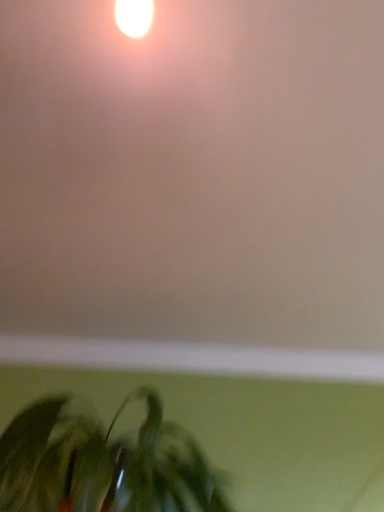
Identify the location of green matte plant at lower left. Image resolution: width=384 pixels, height=512 pixels. (103, 463).

What do you see at coordinates (103, 463) in the screenshot? I see `green matte plant at lower left` at bounding box center [103, 463].

What is the approximate height of green matte plant at lower left?

It is 11.75 inches.

In order to face matte white wall at upper center, should I rotate leftwards or rightwards?

Rotate left and turn 0.400 degrees.

I want to click on matte white wall at upper center, so click(x=194, y=172).

Measure the distance between matte white wall at upper center and camera.

matte white wall at upper center is 27.47 inches away from camera.

What do you see at coordinates (194, 172) in the screenshot?
I see `matte white wall at upper center` at bounding box center [194, 172].

Where is `green matte plant at lower left`? green matte plant at lower left is located at coordinates (103, 463).

Is green matte plant at lower left at the left side of matte white wall at upper center?

Correct, you'll find green matte plant at lower left to the left of matte white wall at upper center.

Is green matte plant at lower left positioned behind matte white wall at upper center?

Yes.

Does point (177, 445) appear closer or farther from the camera than point (26, 73)?

Clearly, point (177, 445) is more distant from the camera than point (26, 73).

From the image's perspective, is green matte plant at lower left under matte white wall at upper center?

Yes.

From a real-world perspective, who is located higher, green matte plant at lower left or matte white wall at upper center?

matte white wall at upper center, from a real-world perspective.

Looking at their sizes, would you say green matte plant at lower left is wider or thinner than matte white wall at upper center?

Considering their sizes, green matte plant at lower left looks slimmer than matte white wall at upper center.

Does green matte plant at lower left have a greater height compared to matte white wall at upper center?

Indeed, green matte plant at lower left has a greater height compared to matte white wall at upper center.

Does green matte plant at lower left have a larger size compared to matte white wall at upper center?

Indeed, green matte plant at lower left has a larger size compared to matte white wall at upper center.

Is green matte plant at lower left situated inside matte white wall at upper center or outside?

The correct answer is: outside.

Is green matte plant at lower left far from matte white wall at upper center?

Actually, green matte plant at lower left and matte white wall at upper center are a little close together.

Could you tell me if green matte plant at lower left is turned towards matte white wall at upper center?

No, green matte plant at lower left is not oriented towards matte white wall at upper center.

What's the angular difference between green matte plant at lower left and matte white wall at upper center's facing directions?

There is a 177-degree angle between the facing directions of green matte plant at lower left and matte white wall at upper center.

You are a GUI agent. You are given a task and a screenshot of the screen. Output one action in this format:
    pyautogui.click(x=<x>, y=<y>)
    Task: Click on the backdrop above the green matte plant at lower left (from the image's perspective)
    This screenshot has width=384, height=512.
    Given the screenshot: What is the action you would take?
    pyautogui.click(x=194, y=172)

Between matte white wall at upper center and green matte plant at lower left, which one appears on the right side from the viewer's perspective?

Positioned to the right is matte white wall at upper center.

Is matte white wall at upper center behind green matte plant at lower left?

No, the depth of matte white wall at upper center is less than that of green matte plant at lower left.

Does point (148, 201) come in front of point (158, 476)?

No, (148, 201) is further to viewer.

From the image's perspective, between matte white wall at upper center and green matte plant at lower left, who is located below?

green matte plant at lower left.

From a real-world perspective, is matte white wall at upper center positioned above or below green matte plant at lower left?

From a real-world perspective, matte white wall at upper center is physically above green matte plant at lower left.

Does matte white wall at upper center have a lesser width compared to green matte plant at lower left?

Incorrect, the width of matte white wall at upper center is not less than that of green matte plant at lower left.

Considering the relative sizes of matte white wall at upper center and green matte plant at lower left in the image provided, is matte white wall at upper center shorter than green matte plant at lower left?

Indeed, matte white wall at upper center has a lesser height compared to green matte plant at lower left.

Considering the relative sizes of matte white wall at upper center and green matte plant at lower left in the image provided, is matte white wall at upper center smaller than green matte plant at lower left?

Indeed, matte white wall at upper center has a smaller size compared to green matte plant at lower left.

Would you say matte white wall at upper center is inside or outside green matte plant at lower left?

matte white wall at upper center exists outside the volume of green matte plant at lower left.

Is matte white wall at upper center far from green matte plant at lower left?

No, there isn't a large distance between matte white wall at upper center and green matte plant at lower left.

Could you tell me if matte white wall at upper center is facing green matte plant at lower left?

No, matte white wall at upper center is not oriented towards green matte plant at lower left.

Locate an element on the screen. The width and height of the screenshot is (384, 512). backdrop in front of the green matte plant at lower left is located at coordinates (194, 172).

Identify the location of houseplant behind the matte white wall at upper center. Image resolution: width=384 pixels, height=512 pixels. (103, 463).

I want to click on backdrop lying on the right of green matte plant at lower left, so click(194, 172).